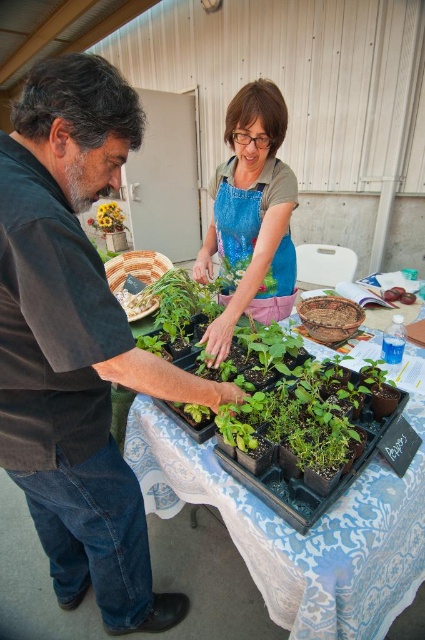
You are a photographer setting up a tripod in this scene. You need to position the camera so that both the matte black shirt at left and the yellow matte flower at upper left are in frame. Considering their heights, which object should be placed closer to the camera to ensure both are fully visible?

The matte black shirt at left is taller than the yellow matte flower at upper left. To ensure both are fully visible, the matte black shirt at left should be placed closer to the camera since it is taller and requires more vertical space in the frame.